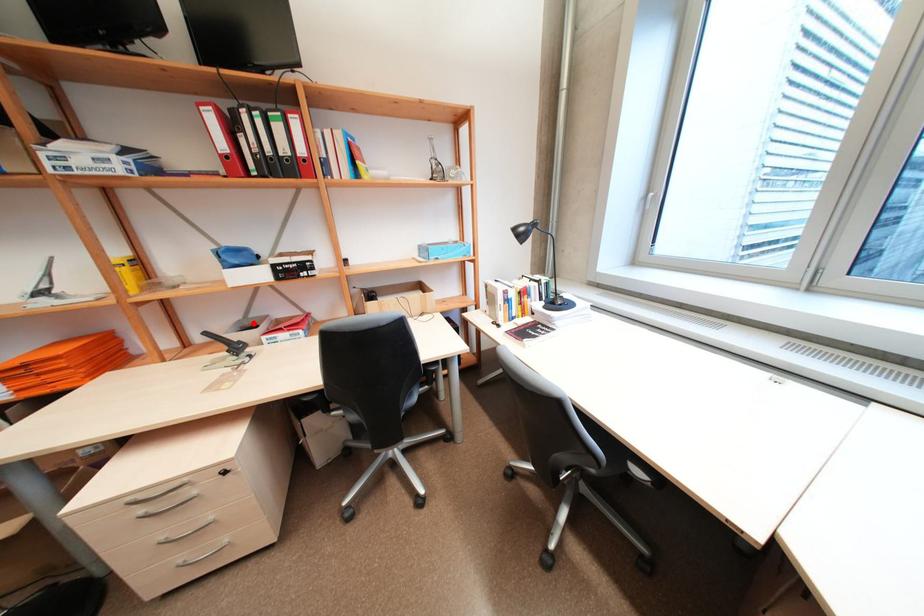
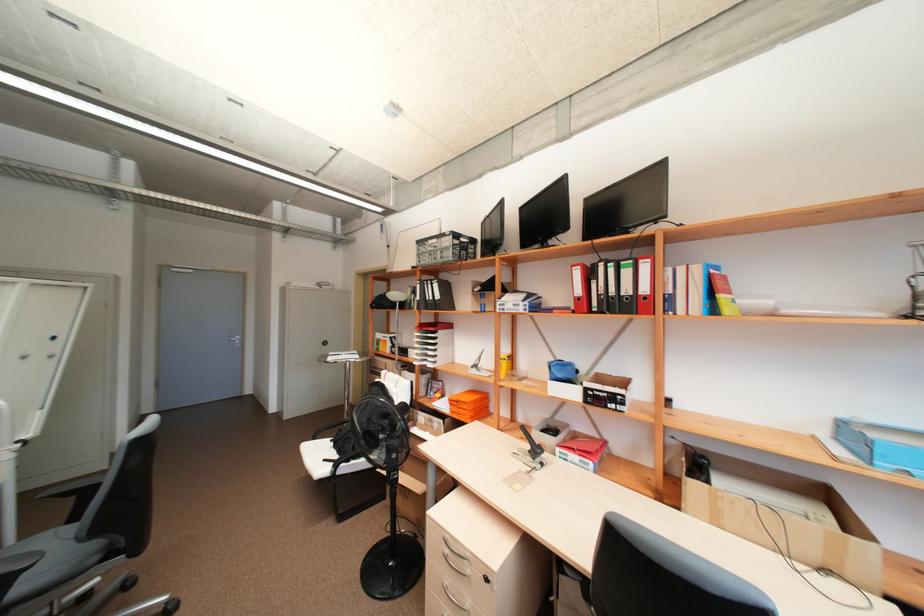
The point at the highlighted location is marked in the first image. Where is the corresponding point in the second image?

(557, 424)